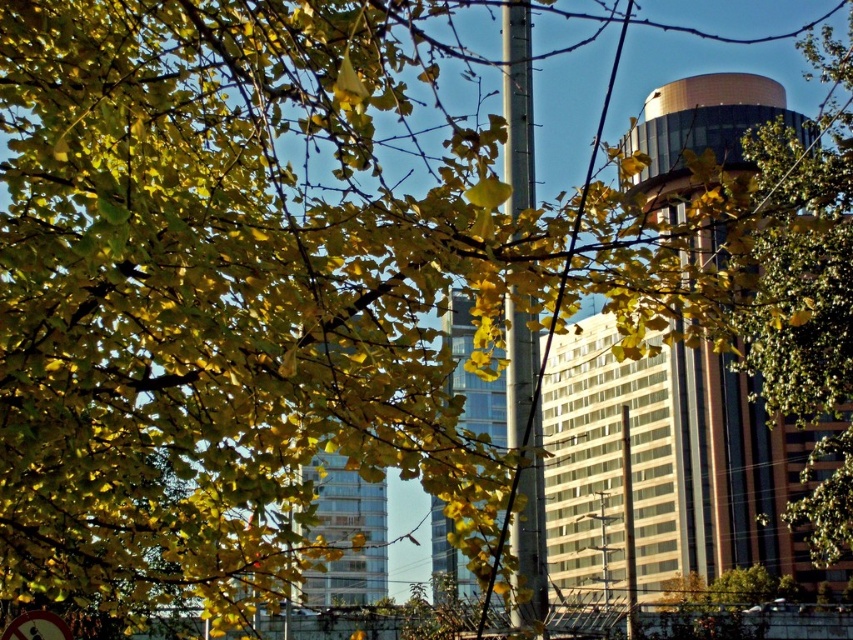
Question: Is glassy reflective skyscraper at center bigger than red plastic circle at lower left?

Choices:
 (A) no
 (B) yes

Answer: (B)

Question: Does gold reflective tower at upper right have a larger size compared to glassy reflective skyscraper at center?

Choices:
 (A) yes
 (B) no

Answer: (A)

Question: In this image, where is gold reflective tower at upper right located relative to red plastic circle at lower left?

Choices:
 (A) below
 (B) above

Answer: (B)

Question: Which point is farther to the camera?

Choices:
 (A) gold reflective tower at upper right
 (B) glassy reflective skyscraper at center

Answer: (B)

Question: Among these objects, which one is nearest to the camera?

Choices:
 (A) glassy reflective skyscraper at center
 (B) red plastic circle at lower left
 (C) gold reflective tower at upper right

Answer: (C)

Question: Which of these objects is positioned closest to the gold reflective tower at upper right?

Choices:
 (A) glassy reflective skyscraper at center
 (B) red plastic circle at lower left

Answer: (A)